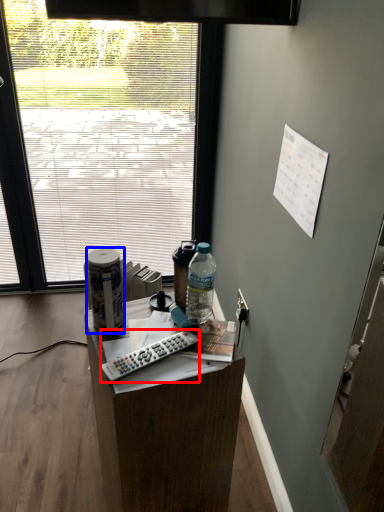
Question: Which object appears closest to the camera in this image, remote control (highlighted by a red box) or bottle (highlighted by a blue box)?

Choices:
 (A) remote control
 (B) bottle

Answer: (A)